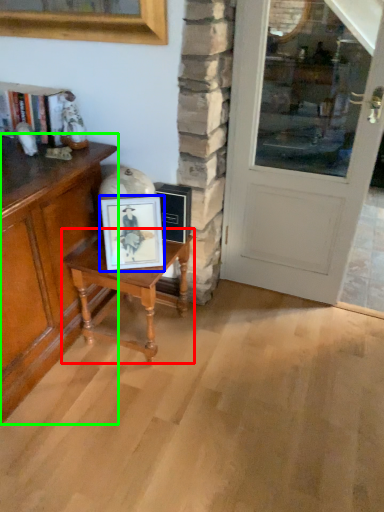
Question: Based on their relative distances, which object is farther from table (highlighted by a red box)? Choose from picture frame (highlighted by a blue box) and cabinetry (highlighted by a green box).

Choices:
 (A) picture frame
 (B) cabinetry

Answer: (B)